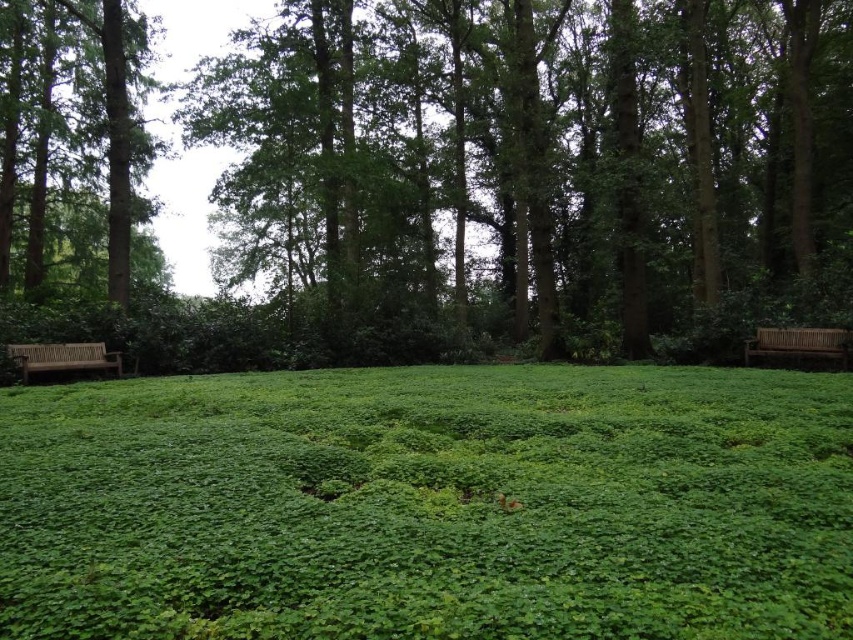
Between green leafy grass at center and green textured tree at left, which one is positioned lower?

green leafy grass at center is lower down.

Between point (364, 566) and point (39, 51), which one is positioned in front?

Point (364, 566) is more forward.

Locate an element on the screen. The width and height of the screenshot is (853, 640). green leafy grass at center is located at coordinates (428, 504).

Does green leafy tree at center have a greater width compared to green leafy grass at center?

Correct, the width of green leafy tree at center exceeds that of green leafy grass at center.

Can you confirm if green leafy tree at center is positioned to the right of green leafy grass at center?

No, green leafy tree at center is not to the right of green leafy grass at center.

Is point (343, 170) less distant than point (251, 525)?

That is False.

Locate an element on the screen. green leafy tree at center is located at coordinates (440, 179).

Does green textured tree at left come in front of wooden bench at right?

No, green textured tree at left is further to the viewer.

Identify the location of green textured tree at left. (68, 141).

Identify the location of green textured tree at left. Image resolution: width=853 pixels, height=640 pixels. (68, 141).